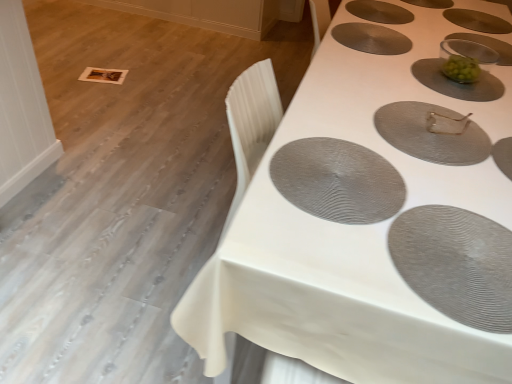
Where is `vacant region to the left of gray textured placemat at lower right, the first oval from the front`? The width and height of the screenshot is (512, 384). vacant region to the left of gray textured placemat at lower right, the first oval from the front is located at coordinates (326, 254).